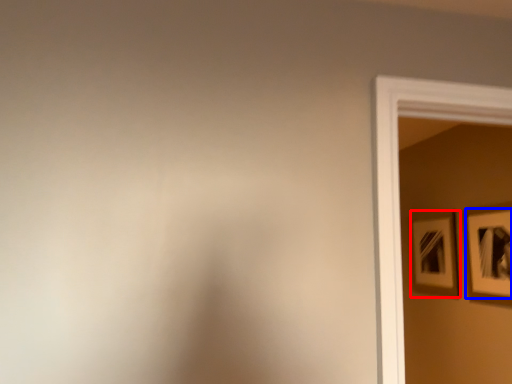
Question: Which object is further to the camera taking this photo, picture frame (highlighted by a red box) or picture frame (highlighted by a blue box)?

Choices:
 (A) picture frame
 (B) picture frame

Answer: (A)